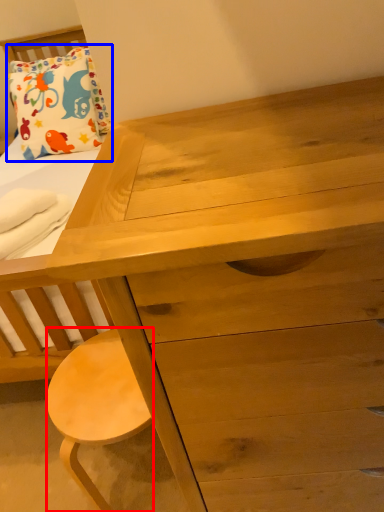
Question: Which of the following is the farthest to the observer, stool (highlighted by a red box) or pillow (highlighted by a blue box)?

Choices:
 (A) stool
 (B) pillow

Answer: (B)